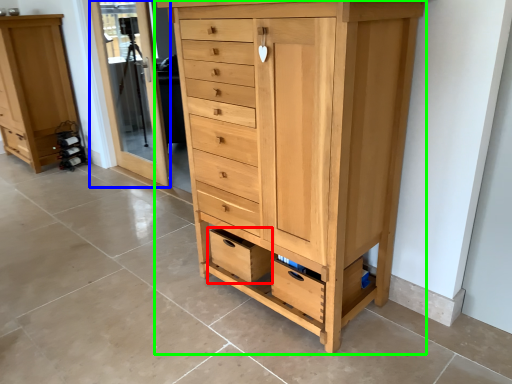
Question: Which object is positioned farthest from drawer (highlighted by a red box)? Select from screen door (highlighted by a blue box) and chest of drawers (highlighted by a green box).

Choices:
 (A) screen door
 (B) chest of drawers

Answer: (A)